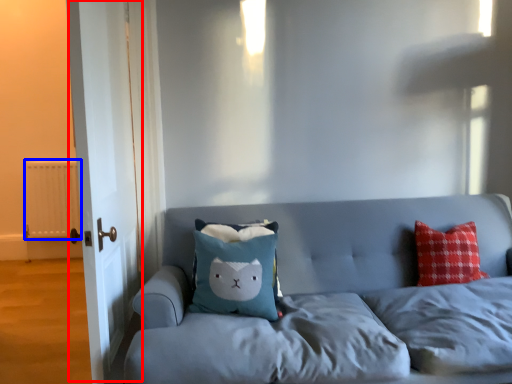
Question: Which of the following is the farthest to the observer, door (highlighted by a red box) or radiator (highlighted by a blue box)?

Choices:
 (A) door
 (B) radiator

Answer: (B)